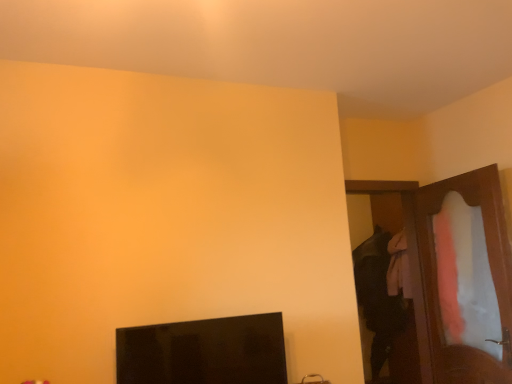
Measure the distance between wooden door at right and camera.

wooden door at right and camera are 9.74 feet apart.

What do you see at coordinates (402, 209) in the screenshot? I see `wooden door at right` at bounding box center [402, 209].

What do you see at coordinates (436, 272) in the screenshot?
I see `wooden dresser at right` at bounding box center [436, 272].

Find the location of `black glossy monitor at lower left`. black glossy monitor at lower left is located at coordinates (204, 352).

Are black glossy monitor at lower left and wooden dresser at right beside each other?

No, black glossy monitor at lower left is not making contact with wooden dresser at right.

Which object is thinner, black glossy monitor at lower left or wooden dresser at right?

Thinner between the two is wooden dresser at right.

Can we say black glossy monitor at lower left lies outside wooden dresser at right?

Absolutely, black glossy monitor at lower left is external to wooden dresser at right.

Considering the sizes of objects wooden door at right and black glossy monitor at lower left in the image provided, who is smaller, wooden door at right or black glossy monitor at lower left?

black glossy monitor at lower left is smaller.

Are wooden door at right and black glossy monitor at lower left far apart?

wooden door at right is far away from black glossy monitor at lower left.

Locate an element on the screen. Image resolution: width=512 pixels, height=384 pixels. door behind the black glossy monitor at lower left is located at coordinates (402, 209).

Which point is more forward, (412, 185) or (138, 339)?

The point (138, 339) is more forward.

Which object is positioned more to the left, wooden door at right or wooden dresser at right?

Positioned to the left is wooden door at right.

Between wooden door at right and wooden dresser at right, which one has larger width?

wooden door at right.

Considering their positions, is wooden door at right located in front of or behind wooden dresser at right?

Visually, wooden door at right is located behind wooden dresser at right.

Is wooden door at right inside or outside of wooden dresser at right?

wooden door at right is outside wooden dresser at right.

Which is in front, wooden dresser at right or wooden door at right?

Positioned in front is wooden dresser at right.

Who is taller, wooden dresser at right or wooden door at right?

wooden door at right.

Would you say wooden door at right is part of wooden dresser at right's contents?

That's incorrect, wooden door at right is not inside wooden dresser at right.

Between wooden dresser at right and black glossy monitor at lower left, which one is positioned behind?

wooden dresser at right is more distant.

From the image's perspective, is wooden dresser at right located above black glossy monitor at lower left?

Yes, from the image's perspective, wooden dresser at right is over black glossy monitor at lower left.

Which is closer to the camera, [505,232] or [204,351]?

Result: Point [505,232] appears to be farther away from the viewer than point [204,351].

Between black glossy monitor at lower left and wooden door at right, which one has more height?

With more height is wooden door at right.

Is wooden door at right at the back of black glossy monitor at lower left?

That's not correct — black glossy monitor at lower left is not looking away from wooden door at right.

From the image's perspective, between black glossy monitor at lower left and wooden door at right, which one is located above?

wooden door at right is shown above in the image.

Which point is more forward, (204,355) or (367,194)?

The point (204,355) is closer.

Locate an element on the screen. The height and width of the screenshot is (384, 512). computer monitor below the wooden dresser at right (from the image's perspective) is located at coordinates (204, 352).

Identify the location of door to the right of black glossy monitor at lower left. The image size is (512, 384). (402, 209).

From the image, which object appears to be farther from black glossy monitor at lower left, wooden door at right or wooden dresser at right?

wooden door at right lies further to black glossy monitor at lower left than the other object.

Estimate the real-world distances between objects in this image. Which object is closer to wooden door at right, black glossy monitor at lower left or wooden dresser at right?

wooden dresser at right.

When comparing their distances from wooden dresser at right, does wooden door at right or black glossy monitor at lower left seem closer?

wooden door at right lies closer to wooden dresser at right than the other object.

Looking at the image, which one is located closer to wooden door at right, wooden dresser at right or black glossy monitor at lower left?

Among the two, wooden dresser at right is located nearer to wooden door at right.

Considering their positions, is wooden dresser at right positioned further to black glossy monitor at lower left than wooden door at right?

wooden door at right is further to black glossy monitor at lower left.

Considering their positions, is black glossy monitor at lower left positioned closer to wooden dresser at right than wooden door at right?

wooden door at right.

Locate an element on the screen. The width and height of the screenshot is (512, 384). door between black glossy monitor at lower left and wooden dresser at right from left to right is located at coordinates (402, 209).